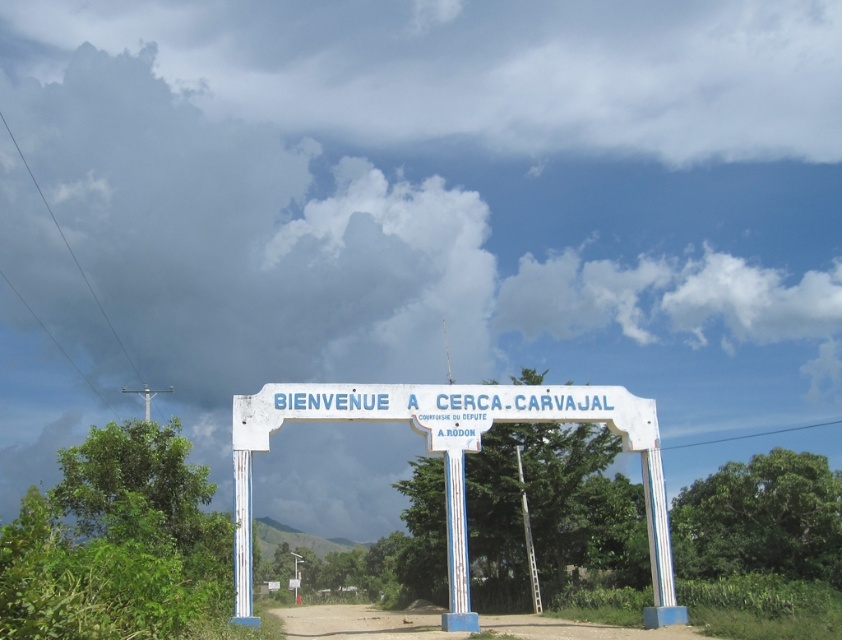
You are standing at the point with coordinates (x=454, y=460) in the image. What object are you directly facing?

The point at coordinates (x=454, y=460) corresponds to the white painted metal arch at center, so you are directly facing the white painted metal arch at center.

You are a delivery driver approaching the white painted metal arch at center and the brown dirt track at lower center. Which object is located higher from the ground?

The white painted metal arch at center is above the brown dirt track at lower center, so it is higher from the ground.